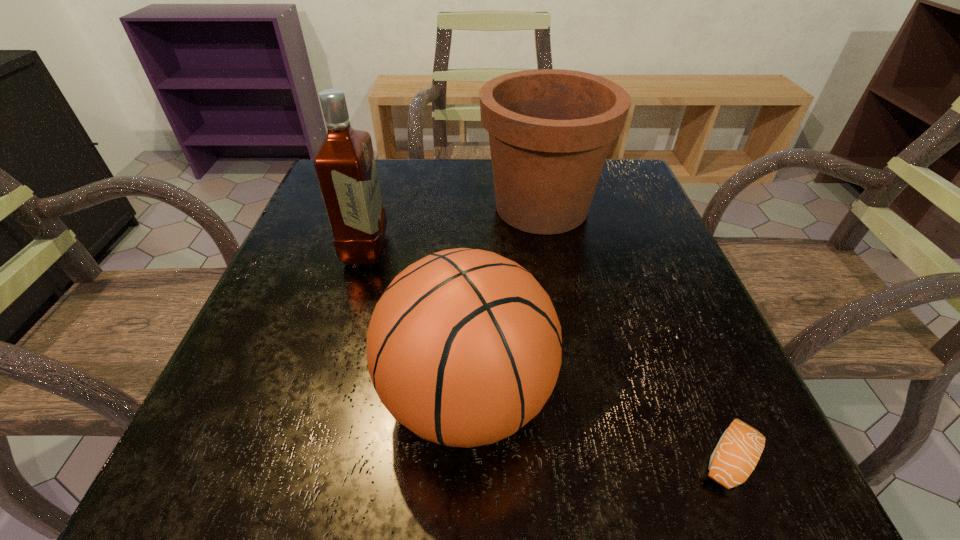
Where is `free space at the left edge of the desktop`? free space at the left edge of the desktop is located at coordinates (335, 303).

Find the location of a particular element. The width and height of the screenshot is (960, 540). free space at the right edge of the desktop is located at coordinates (657, 266).

The height and width of the screenshot is (540, 960). I want to click on free spot between the flowerpot and the tallest object, so click(453, 228).

Locate an element on the screen. The image size is (960, 540). free spot between the flowerpot and the shortest object is located at coordinates (635, 333).

This screenshot has height=540, width=960. I want to click on vacant space that is in between the liquor and the flowerpot, so click(x=453, y=228).

Identify the location of object that is the second nearest to the flowerpot. This screenshot has height=540, width=960. (464, 347).

Where is `object that is the third closest to the flowerpot`? The image size is (960, 540). object that is the third closest to the flowerpot is located at coordinates (738, 451).

Find the location of a particular element. The image size is (960, 540). vacant space that satisfies the following two spatial constraints: 1. on the front side of the flowerpot; 2. on the front label of the leftmost object is located at coordinates (549, 249).

Identify the location of blank space that satisfies the following two spatial constraints: 1. on the front side of the rightmost object; 2. on the left side of the basketball. This screenshot has width=960, height=540. (466, 458).

Locate an element on the screen. The width and height of the screenshot is (960, 540). vacant space that satisfies the following two spatial constraints: 1. on the front label of the basketball; 2. on the left side of the tallest object is located at coordinates (322, 397).